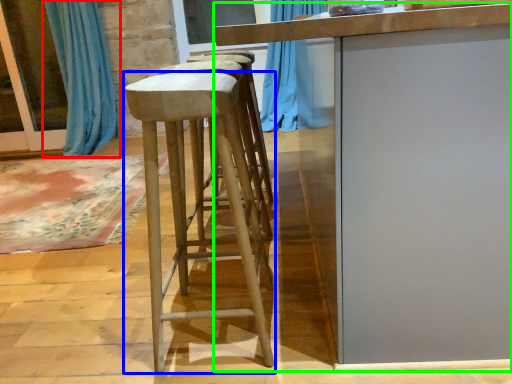
Question: Which object is positioned closest to curtain (highlighted by a red box)? Select from stool (highlighted by a blue box) and table (highlighted by a green box).

Choices:
 (A) stool
 (B) table

Answer: (A)